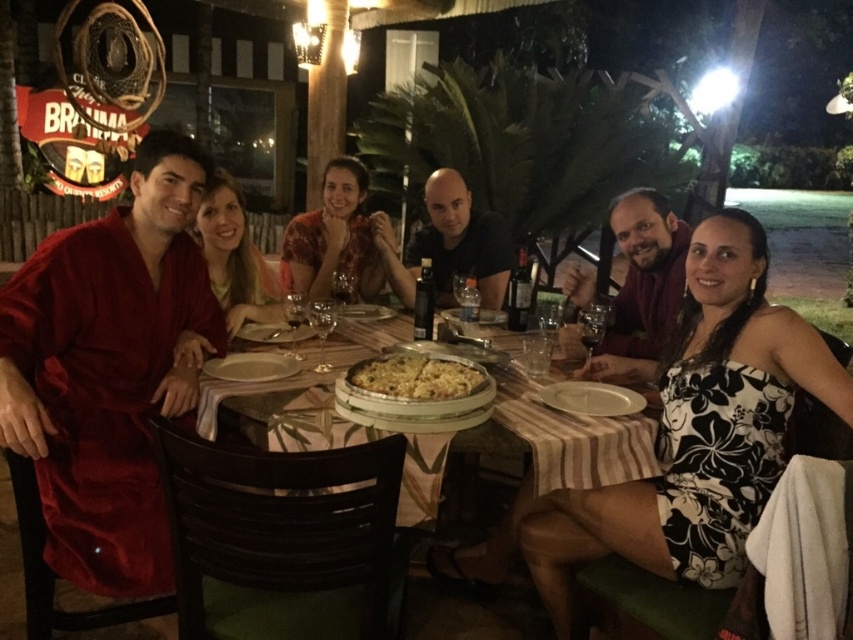
Question: In this image, where is velvety red robe at left located relative to golden brown crusty pizza at center?

Choices:
 (A) above
 (B) below

Answer: (B)

Question: Which object is positioned closest to the matte red robe at upper left?

Choices:
 (A) black matte shirt at center
 (B) wooden table at center

Answer: (B)

Question: Which point is farther from the camera taking this photo?

Choices:
 (A) (369, 381)
 (B) (257, 292)
 (C) (733, 260)

Answer: (B)

Question: Is black floral dress at center above black matte shirt at center?

Choices:
 (A) no
 (B) yes

Answer: (A)

Question: Can you confirm if matte red robe at upper left is thinner than floral print fabric dress at center?

Choices:
 (A) yes
 (B) no

Answer: (A)

Question: Among these objects, which one is nearest to the camera?

Choices:
 (A) golden brown crusty pizza at center
 (B) matte red robe at upper left
 (C) black matte shirt at center
 (D) matte red robe at lower right

Answer: (A)